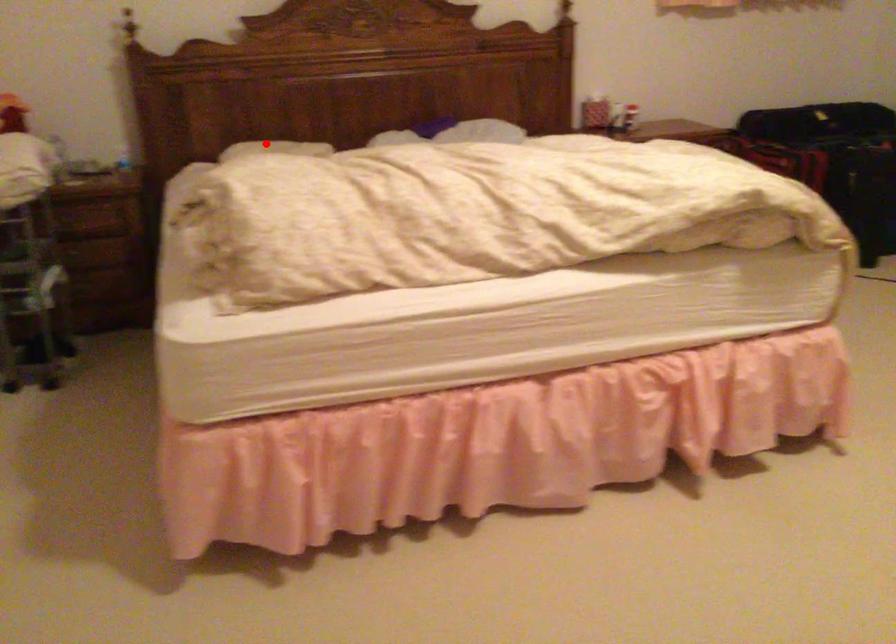
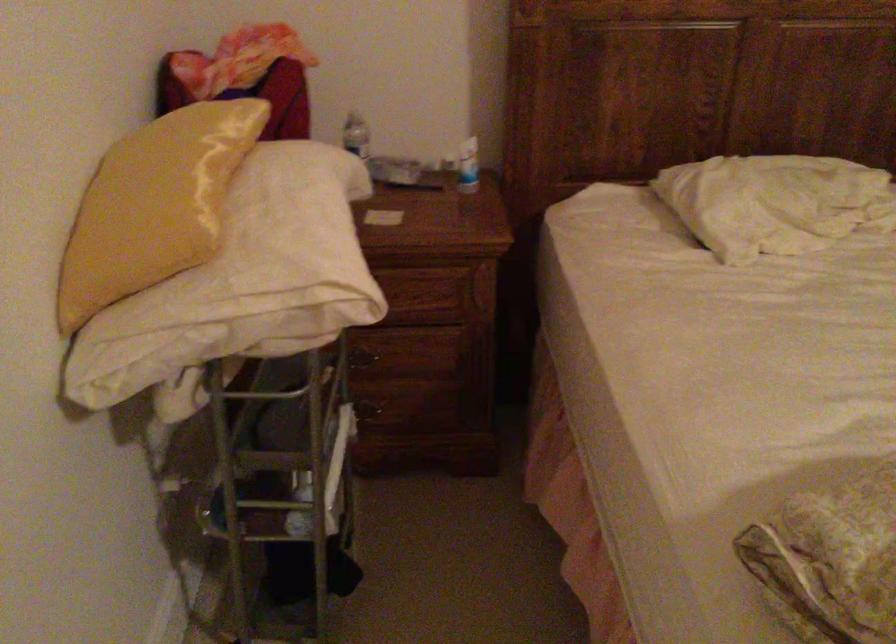
Question: I am providing you with two images of the same scene from different viewpoints. In image1, a red point is highlighted. Considering the same 3D point in image2, which of the following is correct?

Choices:
 (A) It is closer
 (B) It is farther

Answer: (A)